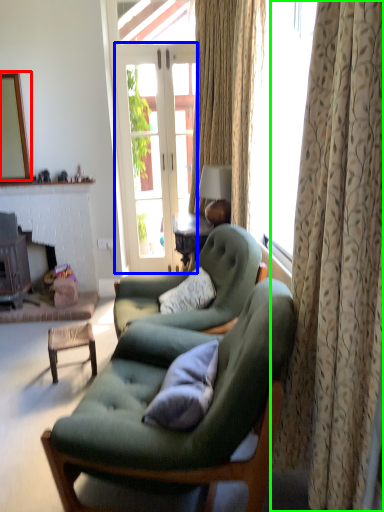
Question: Considering the real-world distances, which object is closest to mirror (highlighted by a red box)? screen door (highlighted by a blue box) or curtain (highlighted by a green box).

Choices:
 (A) screen door
 (B) curtain

Answer: (A)